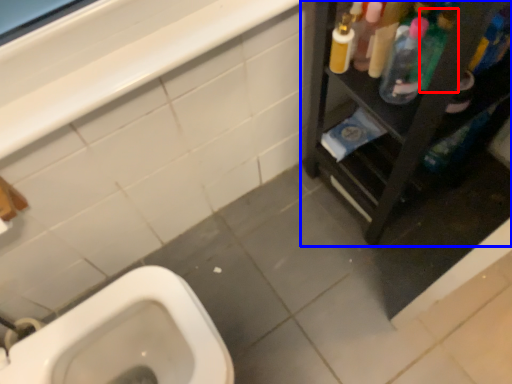
Question: Which point is closer to the camera, cleaning product (highlighted by a red box) or furniture (highlighted by a blue box)?

Choices:
 (A) cleaning product
 (B) furniture

Answer: (B)